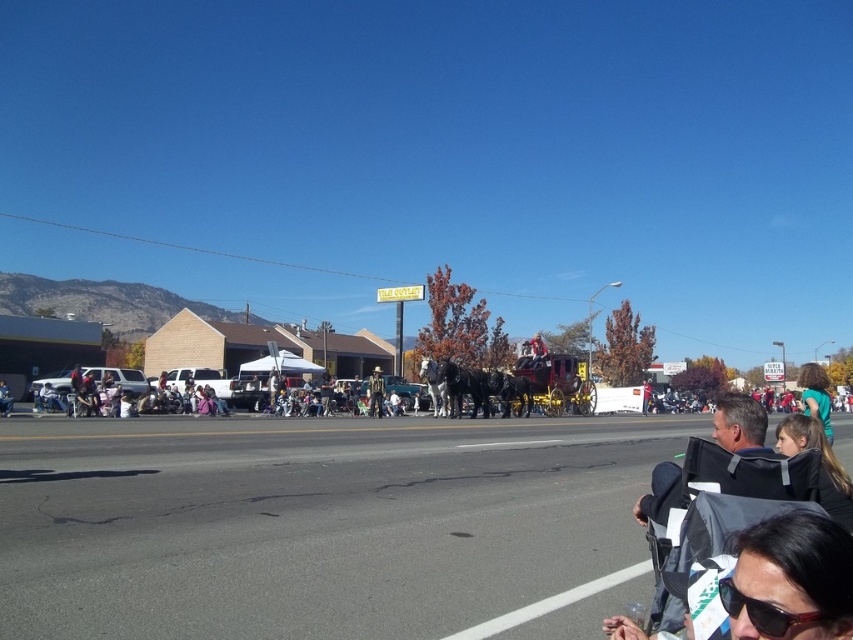
You are a photographer at the event and want to capture both the green matte shirt at center and the wooden cowboy hat at center in a single frame. Which object should you adjust your camera focus on to ensure both are in frame without moving the camera?

The green matte shirt at center is wider than the wooden cowboy hat at center, so you should focus on the green matte shirt at center to ensure both are in frame without moving the camera.

You are a photographer standing at the back of the crowd. You want to take a photo that includes both the green matte shirt at center and the wooden cowboy hat at center. Given that your camera has a maximum focus range of 80 feet, will you be able to capture both subjects in focus without moving closer?

The distance between the green matte shirt at center and the wooden cowboy hat at center is 83.59 feet, which exceeds the camera maximum focus range of 80 feet. Therefore, you won not be able to capture both subjects in focus without moving closer.

You are a photographer at the event and need to capture both the black plastic bag at lower right and the wooden cowboy hat at center in a single frame. Which object should you zoom in on to ensure both are visible without moving the camera?

You should zoom in on the black plastic bag at lower right because it is smaller than the wooden cowboy hat at center, allowing both to fit within the frame when focusing on the smaller object.